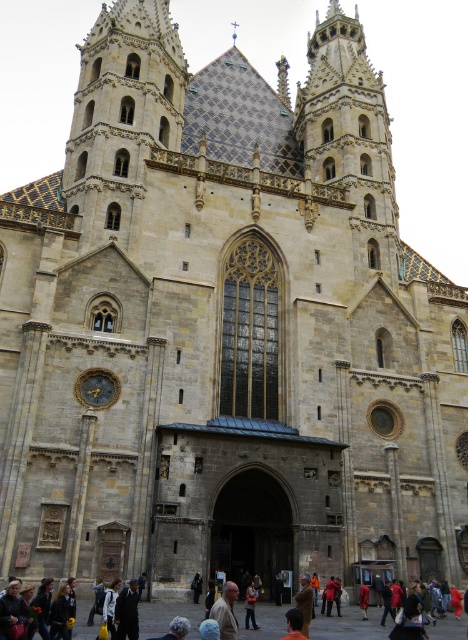
Between light brown leather jacket at lower center and orange fabric shirt at lower center, which one appears on the left side from the viewer's perspective?

From the viewer's perspective, light brown leather jacket at lower center appears more on the left side.

Is light brown leather jacket at lower center below orange fabric shirt at lower center?

No.

Does point (225, 582) come farther from viewer compared to point (298, 636)?

That is True.

This screenshot has height=640, width=468. In order to click on light brown leather jacket at lower center in this screenshot , I will do `click(226, 611)`.

Does light brown leather jacket at lower center have a greater width compared to denim jacket at lower center?

Yes.

Based on the photo, can you confirm if light brown leather jacket at lower center is positioned to the left of denim jacket at lower center?

Yes, light brown leather jacket at lower center is to the left of denim jacket at lower center.

Is point (221, 595) more distant than point (247, 627)?

Yes.

The width and height of the screenshot is (468, 640). In order to click on light brown leather jacket at lower center in this screenshot , I will do `click(226, 611)`.

The height and width of the screenshot is (640, 468). What do you see at coordinates (293, 625) in the screenshot? I see `orange fabric shirt at lower center` at bounding box center [293, 625].

Is orange fabric shirt at lower center further to camera compared to denim jacket at lower center?

No, orange fabric shirt at lower center is in front of denim jacket at lower center.

Identify the location of orange fabric shirt at lower center. (293, 625).

Where is `orange fabric shirt at lower center`? The width and height of the screenshot is (468, 640). orange fabric shirt at lower center is located at coordinates (293, 625).